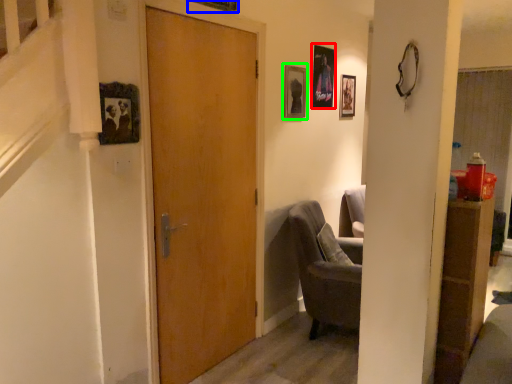
Question: Which is farther away from picture frame (highlighted by a red box)? picture frame (highlighted by a blue box) or picture frame (highlighted by a green box)?

Choices:
 (A) picture frame
 (B) picture frame

Answer: (A)